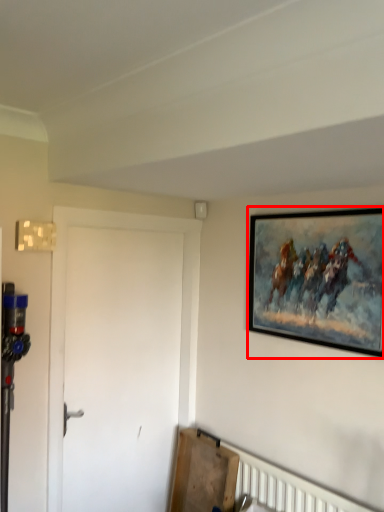
Question: Where is picture frame (annotated by the red box) located in relation to door in the image?

Choices:
 (A) left
 (B) right

Answer: (B)